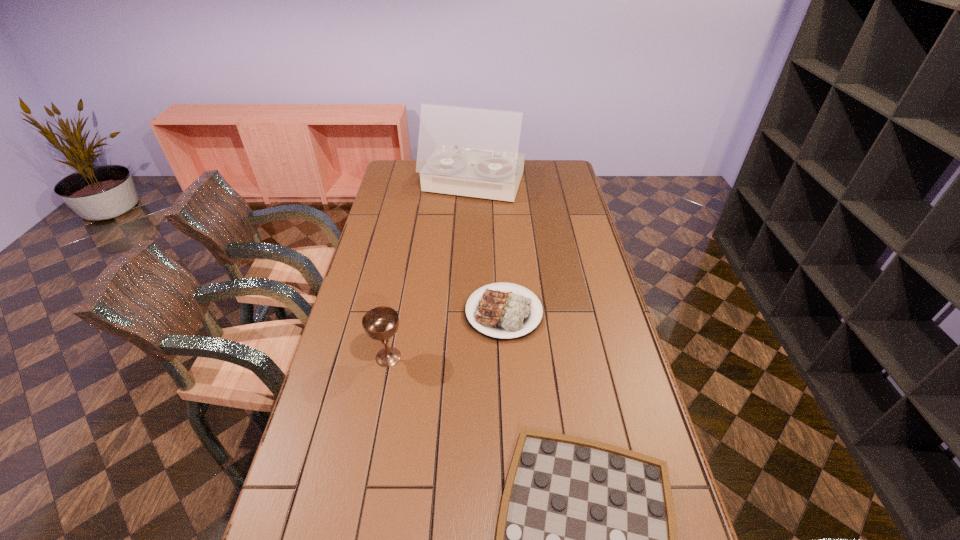
You are a GUI agent. You are given a task and a screenshot of the screen. Output one action in this format:
    pyautogui.click(x=<x>, y=<y>)
    Task: Click on the blank space at the left edge of the desktop
    This screenshot has width=960, height=540.
    Given the screenshot: What is the action you would take?
    pyautogui.click(x=388, y=233)

The height and width of the screenshot is (540, 960). I want to click on free space at the right edge of the desktop, so click(x=589, y=247).

Where is `free space between the chalice and the second shortest object`? free space between the chalice and the second shortest object is located at coordinates coord(446,335).

At what (x,y) coordinates should I click in order to perform the action: click on free space between the record player and the second tallest object. Please return your answer as a coordinate pair (x, y). The height and width of the screenshot is (540, 960). Looking at the image, I should click on (431, 271).

You are a GUI agent. You are given a task and a screenshot of the screen. Output one action in this format:
    pyautogui.click(x=<x>, y=<y>)
    Task: Click on the empty space that is in between the plate and the farthest object
    
    Given the screenshot: What is the action you would take?
    pyautogui.click(x=489, y=248)

Where is `free space between the plate and the second tallest object`? Image resolution: width=960 pixels, height=540 pixels. free space between the plate and the second tallest object is located at coordinates (446, 335).

I want to click on free space between the plate and the third shortest object, so click(446, 335).

Where is `empty space between the plate and the chalice`? This screenshot has height=540, width=960. empty space between the plate and the chalice is located at coordinates (446, 335).

What are the coordinates of `empty location between the record player and the second shortest object` in the screenshot? It's located at (489, 248).

Choose which object is the third nearest neighbor to the record player. Please provide its 2D coordinates. Your answer should be formatted as a tuple, i.e. [(x, y)], where the tuple contains the x and y coordinates of a point satisfying the conditions above.

[(586, 539)]